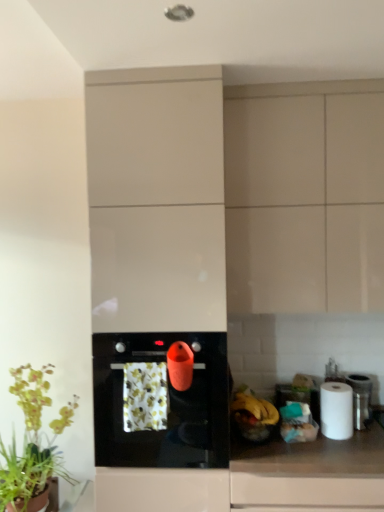
Question: Does white matte paper towel at right appear on the right side of floral-patterned fabric at center?

Choices:
 (A) yes
 (B) no

Answer: (A)

Question: Is white matte paper towel at right located outside floral-patterned fabric at center?

Choices:
 (A) no
 (B) yes

Answer: (B)

Question: Is white matte paper towel at right to the left of floral-patterned fabric at center from the viewer's perspective?

Choices:
 (A) yes
 (B) no

Answer: (B)

Question: From a real-world perspective, is white matte paper towel at right physically above floral-patterned fabric at center?

Choices:
 (A) no
 (B) yes

Answer: (A)

Question: Considering the relative sizes of white matte paper towel at right and floral-patterned fabric at center in the image provided, is white matte paper towel at right thinner than floral-patterned fabric at center?

Choices:
 (A) no
 (B) yes

Answer: (A)

Question: Looking at their shapes, would you say black glossy oven at center is wider or thinner than matte beige cabinet at upper right, acting as the 2th cabinetry starting from the left?

Choices:
 (A) thin
 (B) wide

Answer: (B)

Question: Is black glossy oven at center in front of or behind matte beige cabinet at upper right, the first cabinetry when ordered from right to left, in the image?

Choices:
 (A) front
 (B) behind

Answer: (A)

Question: Is black glossy oven at center situated inside matte beige cabinet at upper right, acting as the 2th cabinetry starting from the left, or outside?

Choices:
 (A) outside
 (B) inside

Answer: (A)

Question: From the image's perspective, is black glossy oven at center located above or below matte beige cabinet at upper right, the first cabinetry when ordered from right to left?

Choices:
 (A) above
 (B) below

Answer: (B)

Question: From the image's perspective, is metallic silver canister at right positioned above or below white glossy countertop at lower right?

Choices:
 (A) below
 (B) above

Answer: (B)

Question: Would you say metallic silver canister at right is inside or outside white glossy countertop at lower right?

Choices:
 (A) inside
 (B) outside

Answer: (B)

Question: Does point (x=365, y=411) appear closer or farther from the camera than point (x=345, y=450)?

Choices:
 (A) farther
 (B) closer

Answer: (A)

Question: From a real-world perspective, is metallic silver canister at right physically located above or below white glossy countertop at lower right?

Choices:
 (A) above
 (B) below

Answer: (A)

Question: Is white glossy countertop at lower right in front of or behind floral-patterned fabric at center in the image?

Choices:
 (A) behind
 (B) front

Answer: (B)

Question: In terms of width, does white glossy countertop at lower right look wider or thinner when compared to floral-patterned fabric at center?

Choices:
 (A) wide
 (B) thin

Answer: (A)